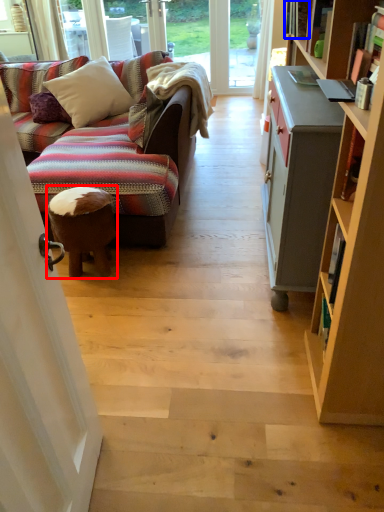
Question: Which point is closer to the camera, stool (highlighted by a red box) or book (highlighted by a blue box)?

Choices:
 (A) stool
 (B) book

Answer: (A)